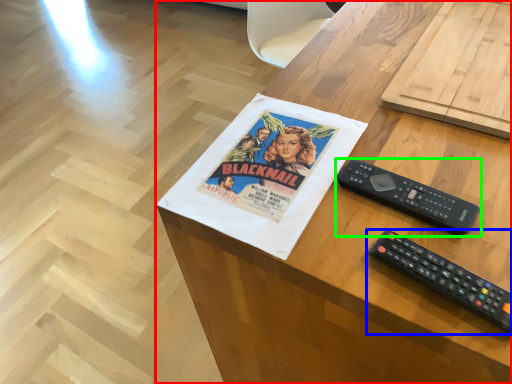
Question: Based on their relative distances, which object is farther from desk (highlighted by a red box)? Choose from remote control (highlighted by a blue box) and remote control (highlighted by a green box).

Choices:
 (A) remote control
 (B) remote control

Answer: (A)